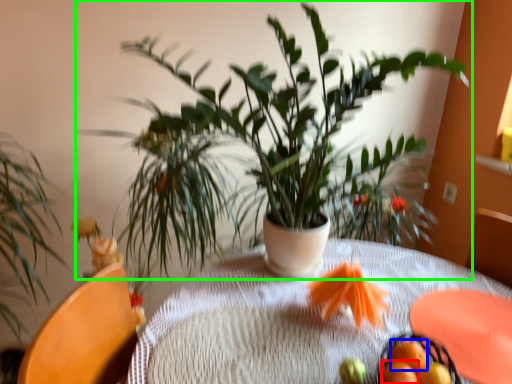
Question: Estimate the real-world distances between objects in this image. Which object is farther from tangerine (highlighted by a red box), tangerine (highlighted by a blue box) or houseplant (highlighted by a green box)?

Choices:
 (A) tangerine
 (B) houseplant

Answer: (B)